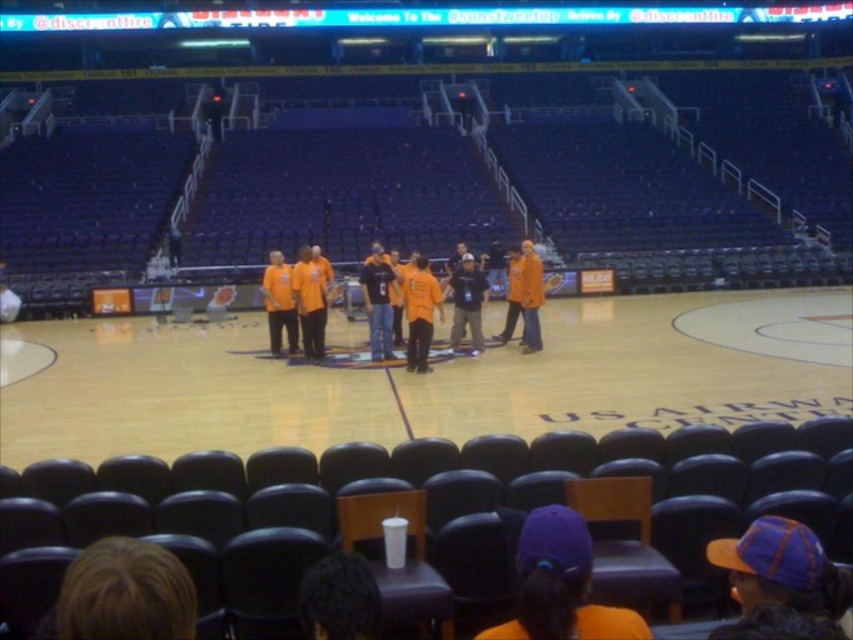
Question: Can you confirm if orange jersey at center is smaller than orange cotton shirt at center?

Choices:
 (A) yes
 (B) no

Answer: (B)

Question: Which point is farther from the camera taking this photo?

Choices:
 (A) (456, 401)
 (B) (279, 292)
 (C) (428, 300)

Answer: (B)

Question: Does wooden basketball court at center have a greater width compared to orange jersey at center?

Choices:
 (A) yes
 (B) no

Answer: (A)

Question: Estimate the real-world distances between objects in this image. Which object is farther from the orange jersey at center?

Choices:
 (A) wooden basketball court at center
 (B) orange cotton shirts at center

Answer: (A)

Question: Does orange jersey at center come behind orange cotton shirt at center?

Choices:
 (A) yes
 (B) no

Answer: (B)

Question: Which point appears closest to the camera in this image?

Choices:
 (A) (479, 339)
 (B) (416, 291)
 (C) (270, 369)
 (D) (286, 332)

Answer: (B)